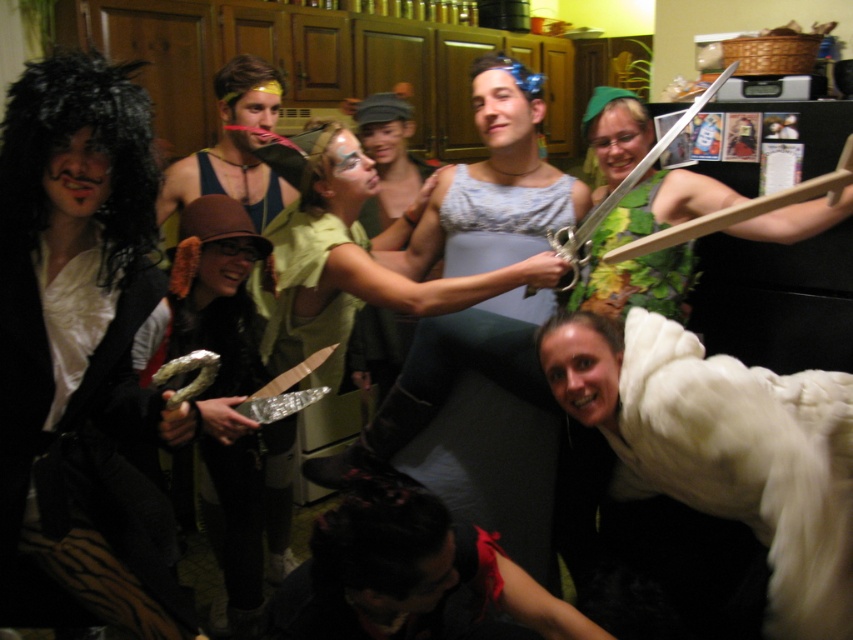
Question: Which point appears closest to the camera in this image?

Choices:
 (A) (293, 196)
 (B) (126, 234)
 (C) (637, 102)
 (D) (791, 401)

Answer: (B)

Question: Does shiny black wig at left appear under green fabric dress at center?

Choices:
 (A) yes
 (B) no

Answer: (A)

Question: Among these objects, which one is farthest from the camera?

Choices:
 (A) shiny black wig at left
 (B) blue fabric headband at center
 (C) white fluffy coat at lower right
 (D) green fabric dress at center

Answer: (B)

Question: Is the position of brown fabric hat at center more distant than that of green leafy costume at upper right?

Choices:
 (A) yes
 (B) no

Answer: (B)

Question: Which point appears farthest from the camera in this image?

Choices:
 (A) (351, 525)
 (B) (666, 410)
 (C) (694, 204)
 (D) (471, 362)

Answer: (C)

Question: Is shiny black wig at left above green leafy costume at upper right?

Choices:
 (A) yes
 (B) no

Answer: (B)